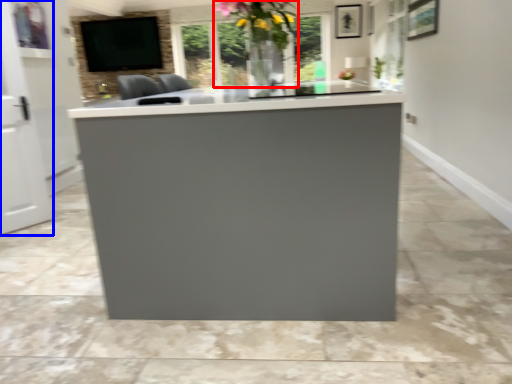
Question: Among these objects, which one is nearest to the camera, floral arrangement (highlighted by a red box) or glass door (highlighted by a blue box)?

Choices:
 (A) floral arrangement
 (B) glass door

Answer: (A)